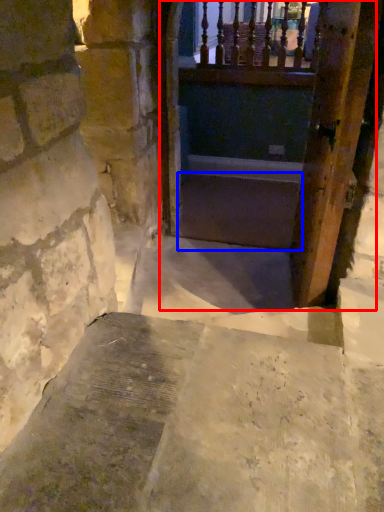
Question: Which object is further to the camera taking this photo, tunnel (highlighted by a red box) or stairs (highlighted by a blue box)?

Choices:
 (A) tunnel
 (B) stairs

Answer: (B)